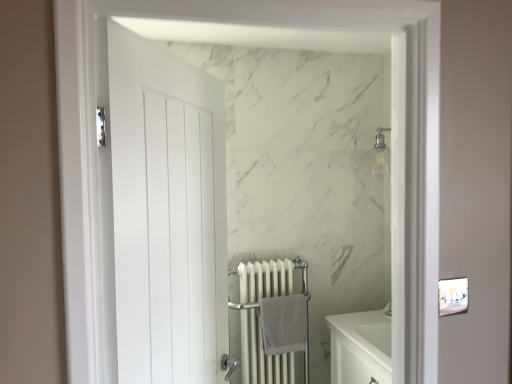
Locate an element on the screen. The image size is (512, 384). free space above white metal radiator at center (from a real-world perspective) is located at coordinates (263, 264).